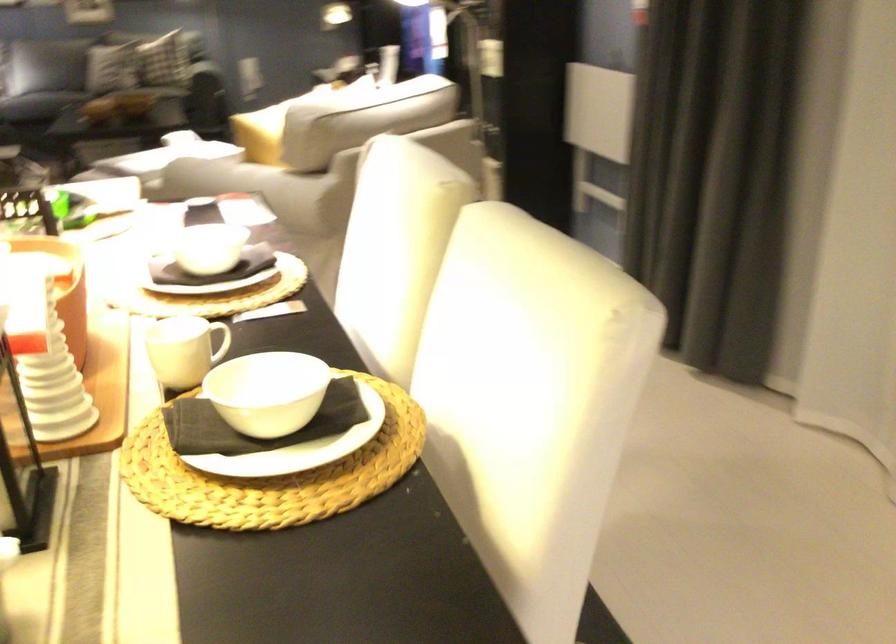
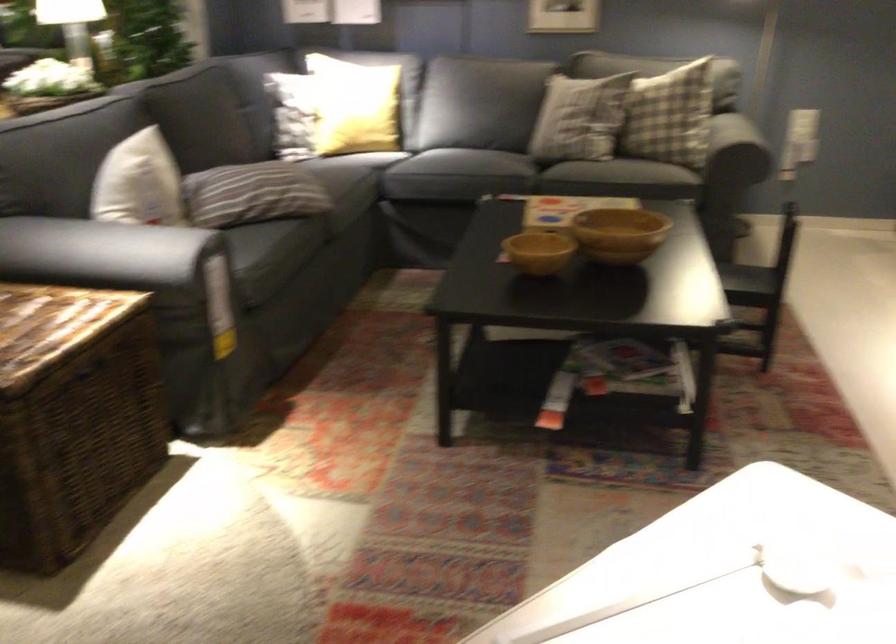
In the second image, find the point that corresponds to point 136,93 in the first image.

(618, 234)